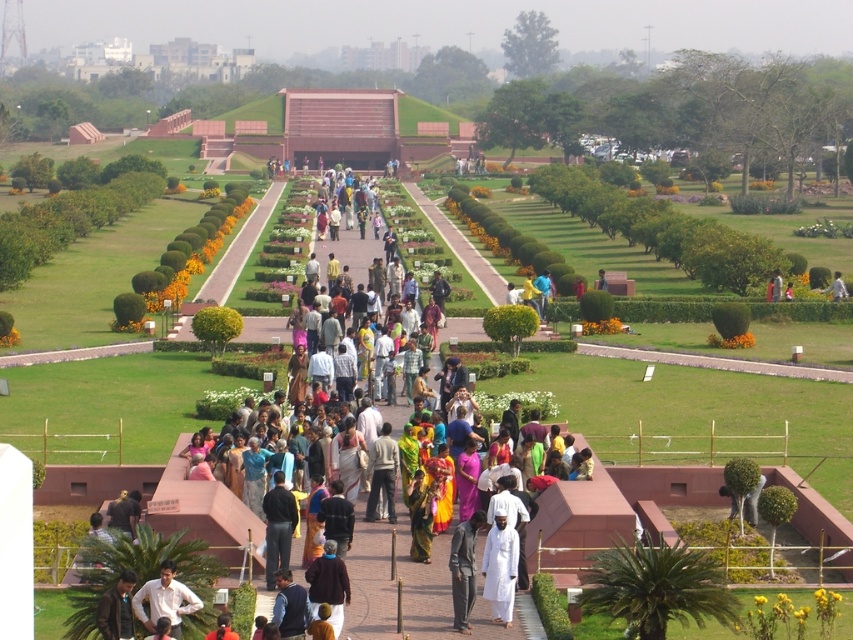
Does white matte shirt at center appear on the right side of dark brown leather jacket at lower left?

Correct, you'll find white matte shirt at center to the right of dark brown leather jacket at lower left.

Is white matte shirt at center bigger than dark brown leather jacket at lower left?

Correct, white matte shirt at center is larger in size than dark brown leather jacket at lower left.

You are a GUI agent. You are given a task and a screenshot of the screen. Output one action in this format:
    pyautogui.click(x=<x>, y=<y>)
    Task: Click on the white matte shirt at center
    The width and height of the screenshot is (853, 640).
    Given the screenshot: What is the action you would take?
    pyautogui.click(x=165, y=600)

Where is `white matte shirt at center`? white matte shirt at center is located at coordinates (165, 600).

Can you confirm if white matte shirt at center is shorter than dark blue jeans at center?

Yes.

Is white matte shirt at center further to the viewer compared to dark blue jeans at center?

No, it is not.

Does point (166, 577) come in front of point (287, 544)?

Yes.

The width and height of the screenshot is (853, 640). In order to click on white matte shirt at center in this screenshot , I will do `click(165, 600)`.

Between white matte shirt at center and light blue fabric at center, which one has less height?

With less height is light blue fabric at center.

Who is positioned more to the left, white matte shirt at center or light blue fabric at center?

From the viewer's perspective, white matte shirt at center appears more on the left side.

The width and height of the screenshot is (853, 640). Find the location of `white matte shirt at center`. white matte shirt at center is located at coordinates (165, 600).